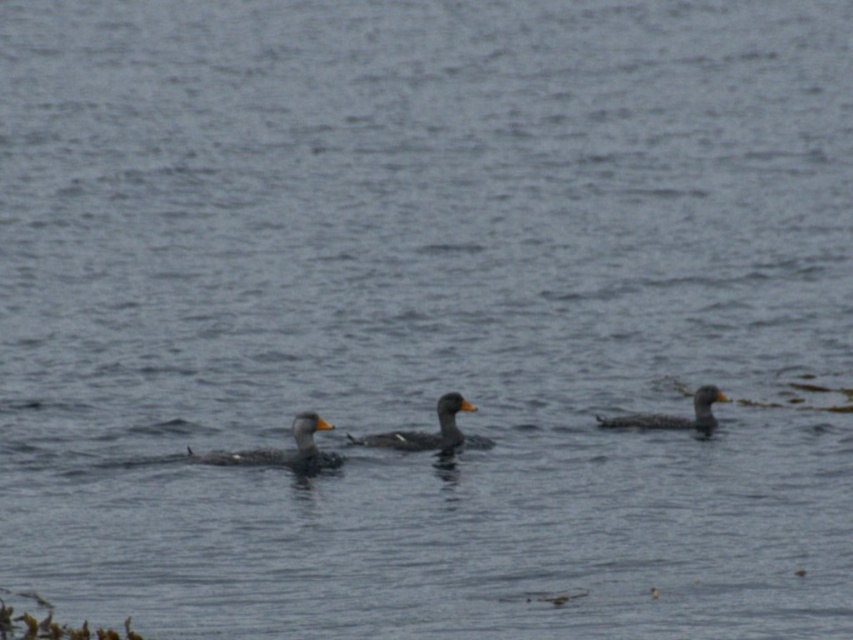
Question: Estimate the real-world distances between objects in this image. Which object is closer to the gray matte duck at center?

Choices:
 (A) speckled gray duck at right
 (B) speckled gray duck at center

Answer: (B)

Question: Does gray matte duck at center have a larger size compared to speckled gray duck at right?

Choices:
 (A) yes
 (B) no

Answer: (A)

Question: Can you confirm if gray matte duck at center is positioned to the right of speckled gray duck at right?

Choices:
 (A) no
 (B) yes

Answer: (A)

Question: Does gray matte duck at center have a lesser width compared to speckled gray duck at center?

Choices:
 (A) no
 (B) yes

Answer: (A)

Question: Which point is closer to the camera?

Choices:
 (A) speckled gray duck at right
 (B) speckled gray duck at center
 (C) gray matte duck at center

Answer: (C)

Question: Which object is positioned closest to the speckled gray duck at right?

Choices:
 (A) gray matte duck at center
 (B) speckled gray duck at center

Answer: (B)